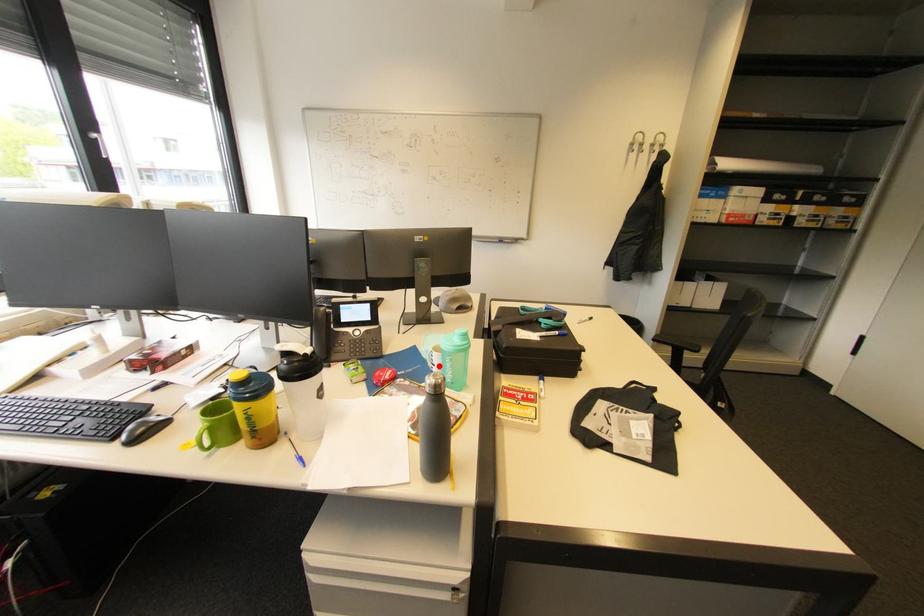
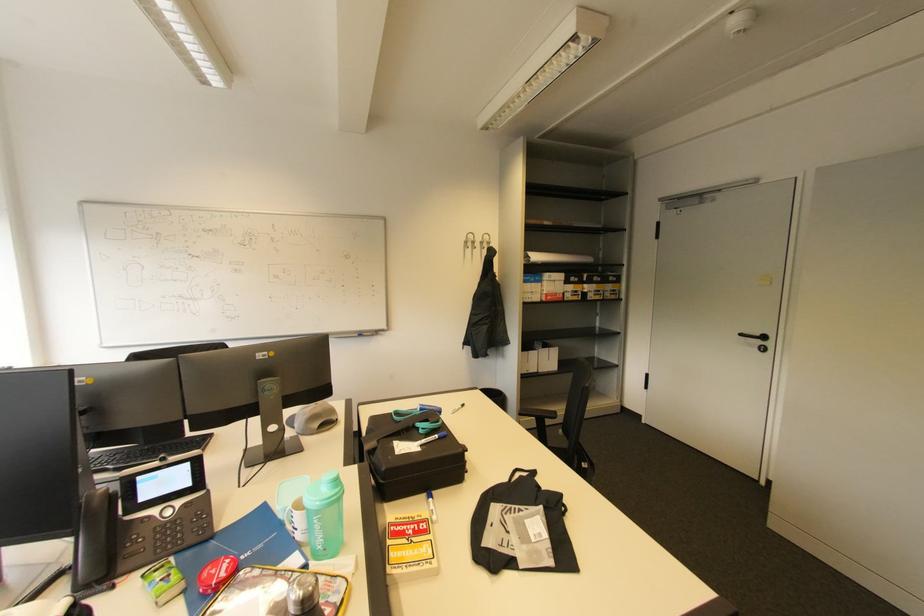
Question: I am providing you with two images of the same scene from different viewpoints. A red point is marked on the first image. At the location where the point appears in image 1, is it still visible in image 2?

Choices:
 (A) Yes
 (B) No

Answer: (A)